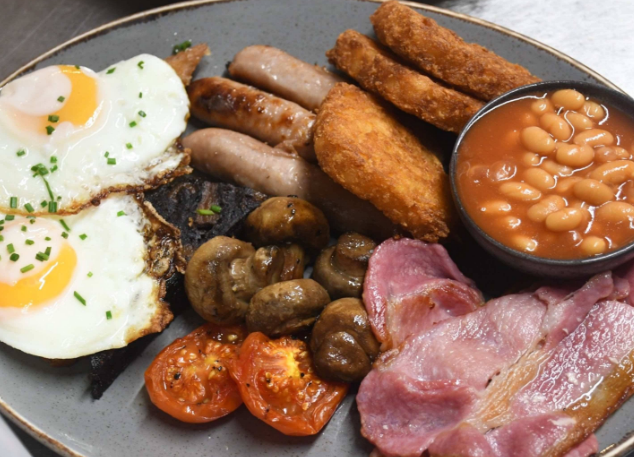
Locate an element on the screen. This screenshot has width=634, height=457. plate is located at coordinates (309, 27).